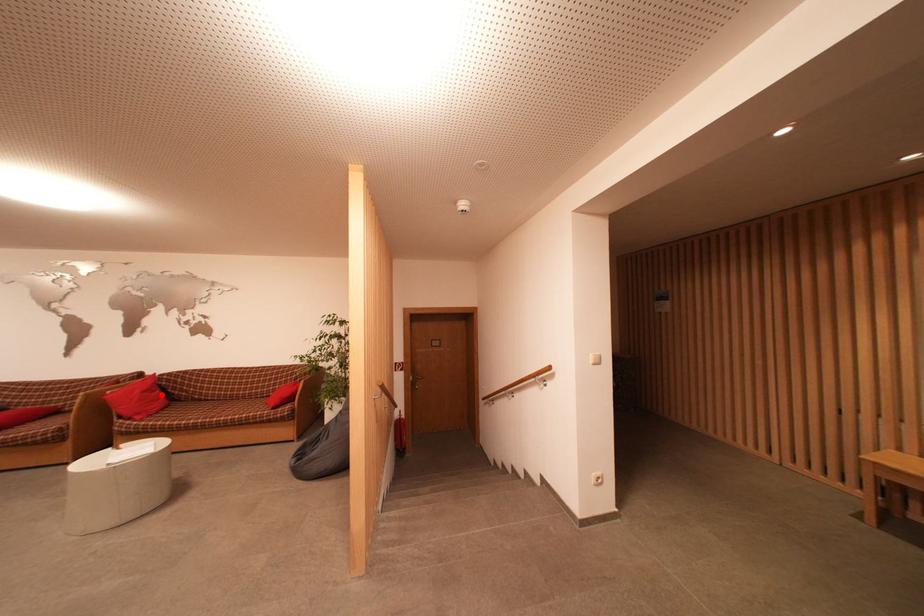
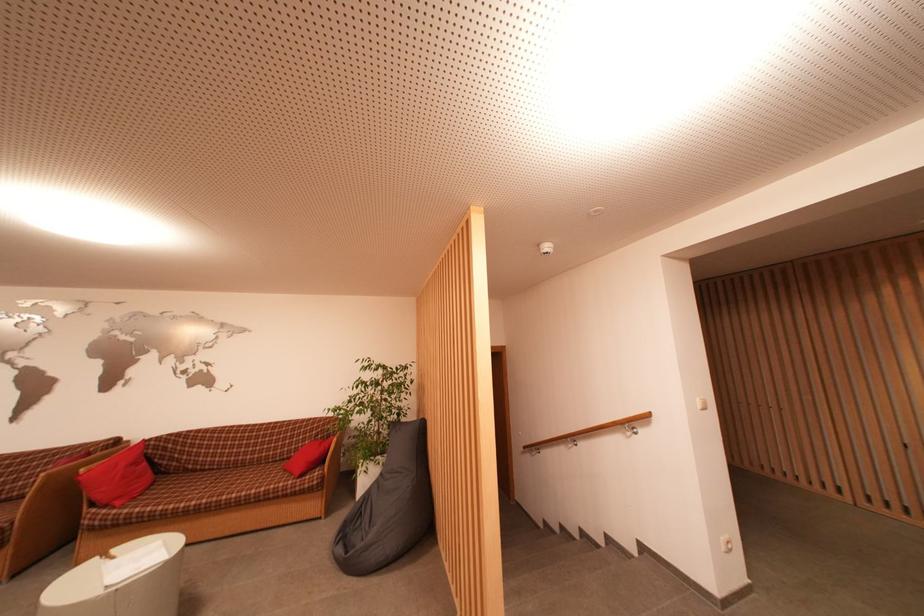
Question: I am providing you with two images of the same scene from different viewpoints. A red point is marked on the first image. At the location where the point appears in image 1, is it still visible in image 2?

Choices:
 (A) Yes
 (B) No

Answer: (A)